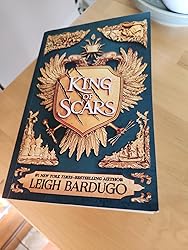
Where is `table`? The width and height of the screenshot is (188, 250). table is located at coordinates (135, 231).